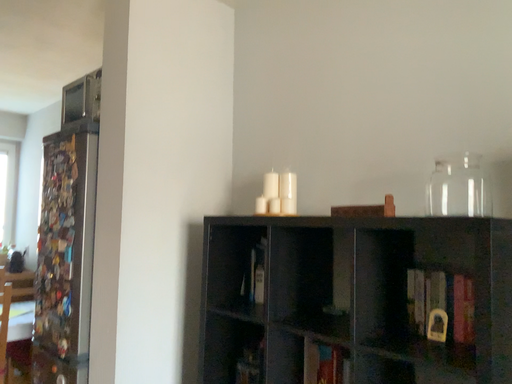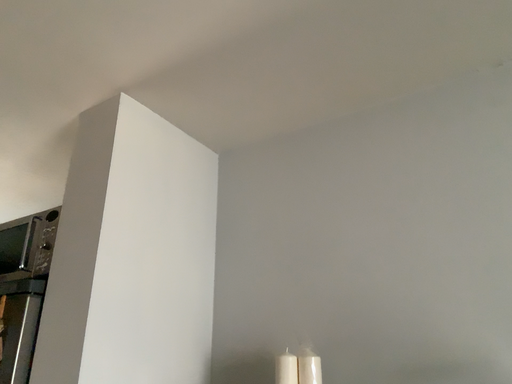
Question: Which way did the camera rotate in the video?

Choices:
 (A) rotated downward
 (B) rotated upward

Answer: (B)